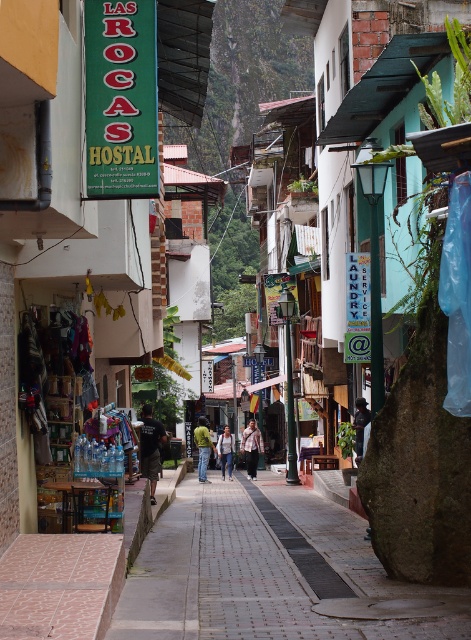
Question: Which is farther from the plaid shirt at center?

Choices:
 (A) green fabric jacket at center
 (B) paved stone sidewalk at center
 (C) dark brown leather jacket at center
 (D) light blue denim jeans at center

Answer: (C)

Question: Can you confirm if green fabric jacket at center is wider than light blue denim jeans at center?

Choices:
 (A) yes
 (B) no

Answer: (A)

Question: Which is farther from the dark gray t-shirt at center?

Choices:
 (A) green fabric jacket at center
 (B) light blue denim jeans at center
 (C) dark brown leather jacket at center
 (D) paved stone sidewalk at center

Answer: (B)

Question: Is plaid shirt at center wider than light blue denim jeans at center?

Choices:
 (A) yes
 (B) no

Answer: (A)

Question: Among these points, which one is farthest from the camera?

Choices:
 (A) click(148, 480)
 (B) click(203, 422)

Answer: (B)

Question: Is paved stone sidewalk at center further to the viewer compared to plaid shirt at center?

Choices:
 (A) yes
 (B) no

Answer: (B)